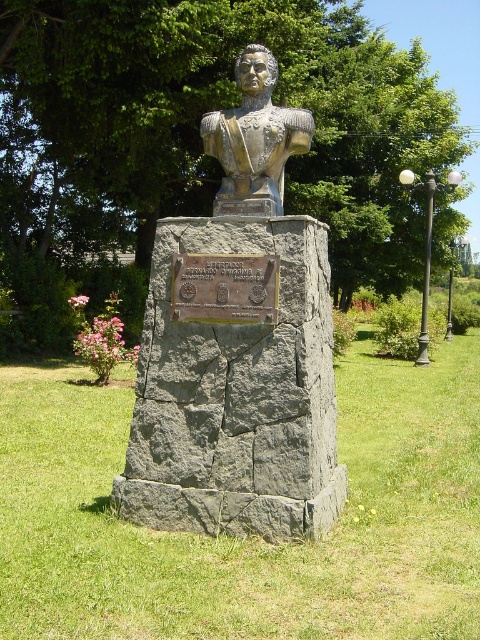
Which is in front, point (262, 48) or point (193, 300)?

Point (193, 300) is in front.

Is point (228, 148) positioned behind point (252, 307)?

That is True.

The image size is (480, 640). I want to click on shiny bronze bust at center, so tap(254, 140).

Does point (332, 365) come behind point (264, 102)?

Yes.

Is point (145, 424) less distant than point (296, 145)?

Yes, point (145, 424) is in front of point (296, 145).

Locate an element on the screen. gold-bronze bust at center is located at coordinates (239, 346).

Is point (154, 248) in front of point (196, 257)?

No, (154, 248) is behind (196, 257).

Which is behind, point (229, 296) or point (218, 314)?

The point (218, 314) is behind.

Locate an element on the screen. gold-bronze bust at center is located at coordinates (239, 346).